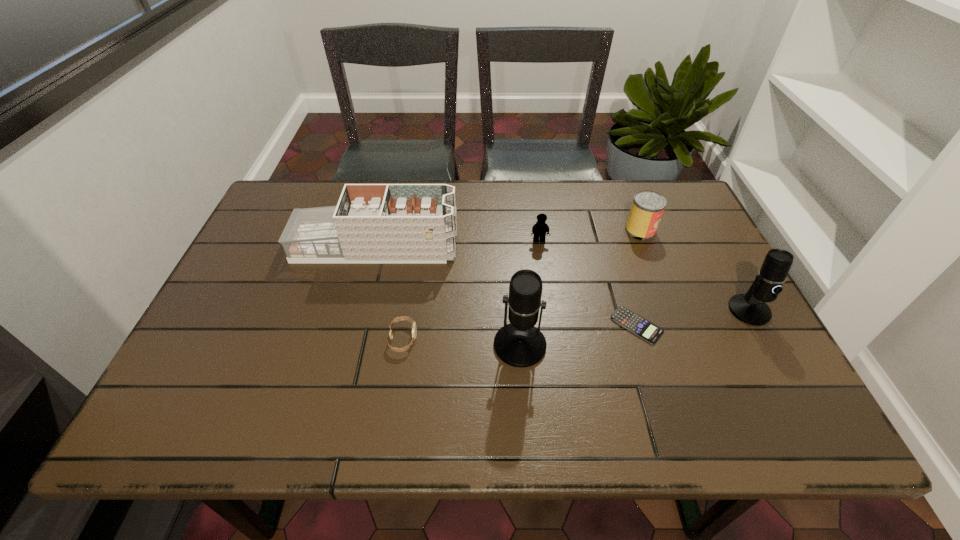
Image resolution: width=960 pixels, height=540 pixels. I want to click on can at the right edge, so click(x=647, y=208).

I want to click on object that is at the far right corner, so click(647, 208).

What are the coordinates of `vacant position at the far edge of the desktop` in the screenshot? It's located at (x=493, y=205).

This screenshot has height=540, width=960. Find the location of `vacant space at the near edge`. vacant space at the near edge is located at coordinates (525, 369).

Identify the location of free spot at the left edge of the desktop. The width and height of the screenshot is (960, 540). (290, 281).

Locate an element on the screen. blank space at the far left corner of the desktop is located at coordinates (281, 225).

The image size is (960, 540). In the image, there is a desktop. Find the location of `vacant area at the far right corner`. vacant area at the far right corner is located at coordinates (663, 222).

This screenshot has width=960, height=540. Find the location of `unoccupied area between the calculator and the dollhouse`. unoccupied area between the calculator and the dollhouse is located at coordinates (506, 286).

Where is `free space between the Lego and the right microphone`? The width and height of the screenshot is (960, 540). free space between the Lego and the right microphone is located at coordinates (644, 275).

Where is `vacant space that's between the dollhouse and the shortest object`? Image resolution: width=960 pixels, height=540 pixels. vacant space that's between the dollhouse and the shortest object is located at coordinates (506, 286).